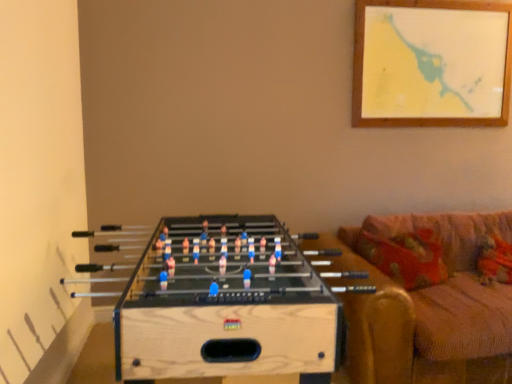
Question: Considering their positions, is natural wood foosball table at lower left located in front of or behind velvet orange couch at right?

Choices:
 (A) front
 (B) behind

Answer: (A)

Question: Visually, is natural wood foosball table at lower left positioned to the left or to the right of velvet orange couch at right?

Choices:
 (A) right
 (B) left

Answer: (B)

Question: Considering the positions of natural wood foosball table at lower left and velvet orange couch at right in the image, is natural wood foosball table at lower left taller or shorter than velvet orange couch at right?

Choices:
 (A) short
 (B) tall

Answer: (B)

Question: Considering the positions of point (474, 332) and point (369, 283), is point (474, 332) closer or farther from the camera than point (369, 283)?

Choices:
 (A) farther
 (B) closer

Answer: (B)

Question: Relative to natural wood foosball table at lower left, is velvet orange couch at right in front or behind?

Choices:
 (A) behind
 (B) front

Answer: (A)

Question: From their relative heights in the image, would you say velvet orange couch at right is taller or shorter than natural wood foosball table at lower left?

Choices:
 (A) short
 (B) tall

Answer: (A)

Question: Is velvet orange couch at right inside the boundaries of natural wood foosball table at lower left, or outside?

Choices:
 (A) outside
 (B) inside

Answer: (A)